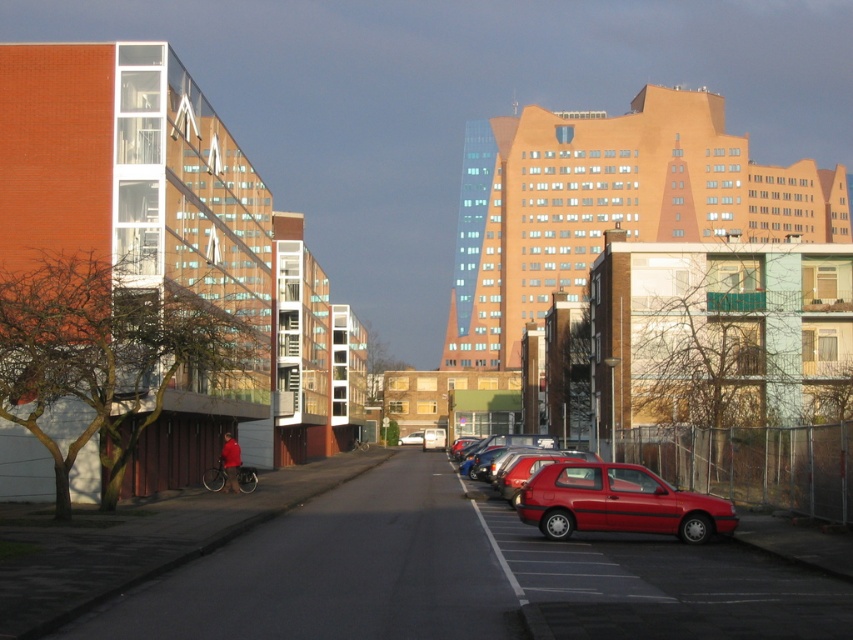
Looking at this image, who is shorter, shiny red hatchback at lower right or matte red car at center?

Standing shorter between the two is shiny red hatchback at lower right.

Between shiny red hatchback at lower right and matte red car at center, which one is positioned higher?

shiny red hatchback at lower right is above.

Who is more forward, (598,529) or (403,444)?

Point (598,529) is more forward.

Find the location of a particular element. The image size is (853, 640). shiny red hatchback at lower right is located at coordinates (618, 502).